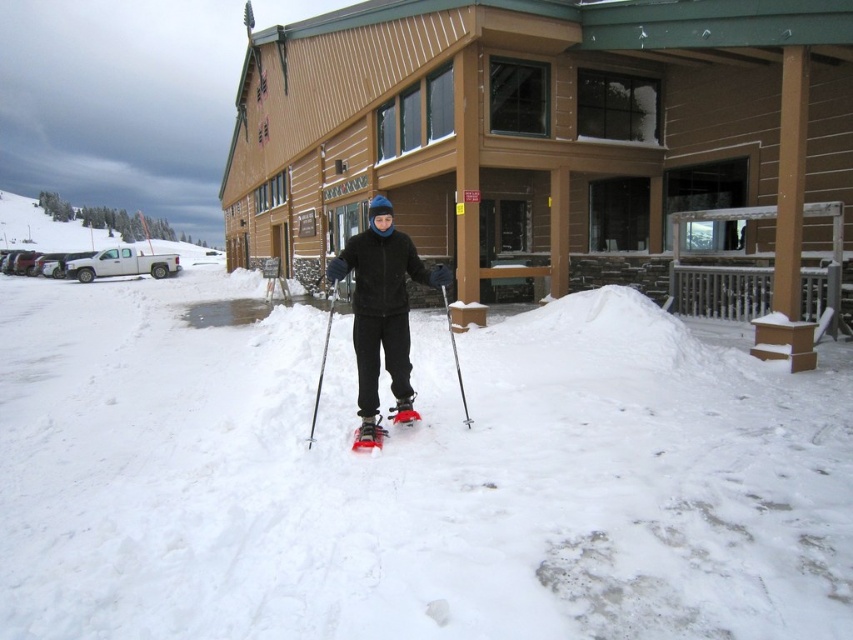
You are planning to pack your gear for a winter trip. You have a bag that can only fit items shorter than the silver metallic ski pole at center. Can you safely place the red rubber ski at center into your bag?

The red rubber ski at center is shorter than the silver metallic ski pole at center, so it can fit in the bag designed for items shorter than the silver metallic ski pole at center.

You are the person in the snowy scene holding two silver ski poles. One is labeled as the metallic silver ski pole at center and the other as the silver metallic ski pole at center. Which one is positioned higher?

The metallic silver ski pole at center is positioned higher than the silver metallic ski pole at center.